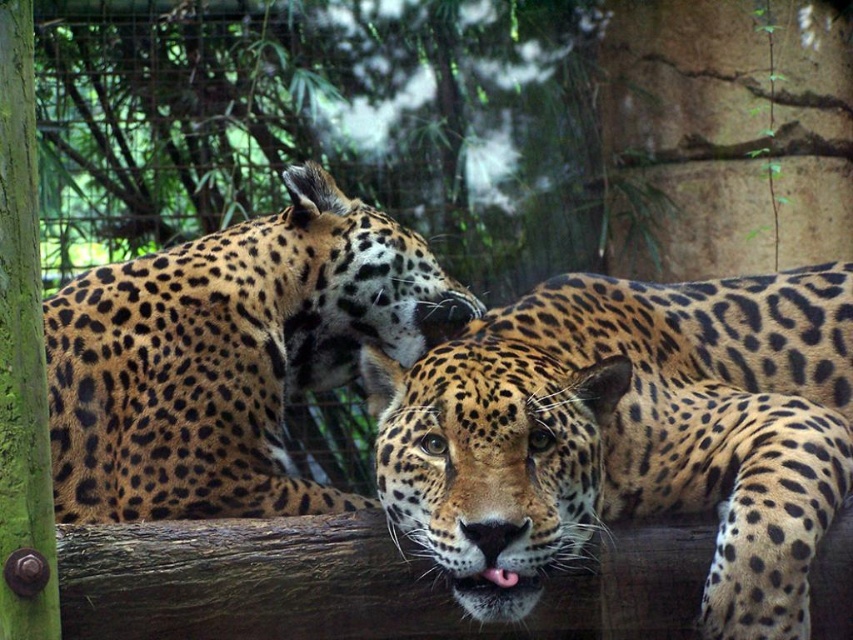
Does spotted fur leopard at center appear on the right side of spotted fur leopard at upper left?

Yes, spotted fur leopard at center is to the right of spotted fur leopard at upper left.

Does point (787, 449) come closer to viewer compared to point (242, 355)?

Yes.

You are a GUI agent. You are given a task and a screenshot of the screen. Output one action in this format:
    pyautogui.click(x=<x>, y=<y>)
    Task: Click on the spotted fur leopard at center
    
    Given the screenshot: What is the action you would take?
    point(628,435)